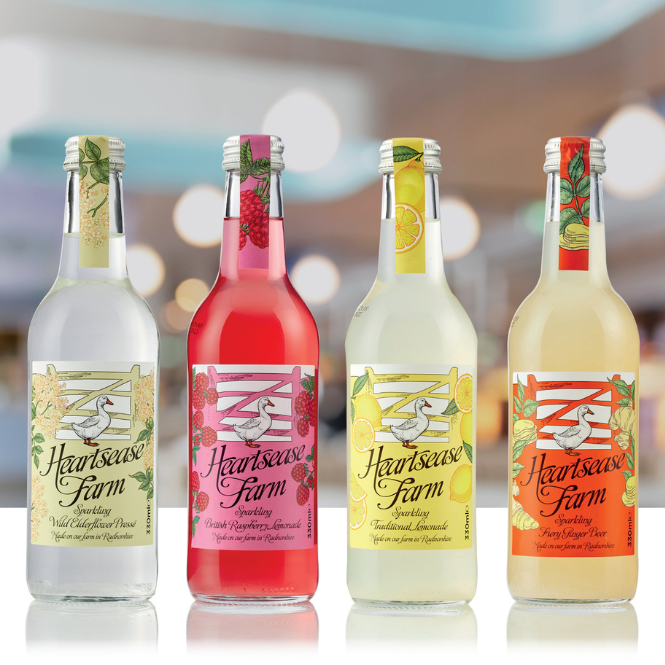
Identify the location of bottles. (92, 304), (217, 312), (396, 311), (560, 313).